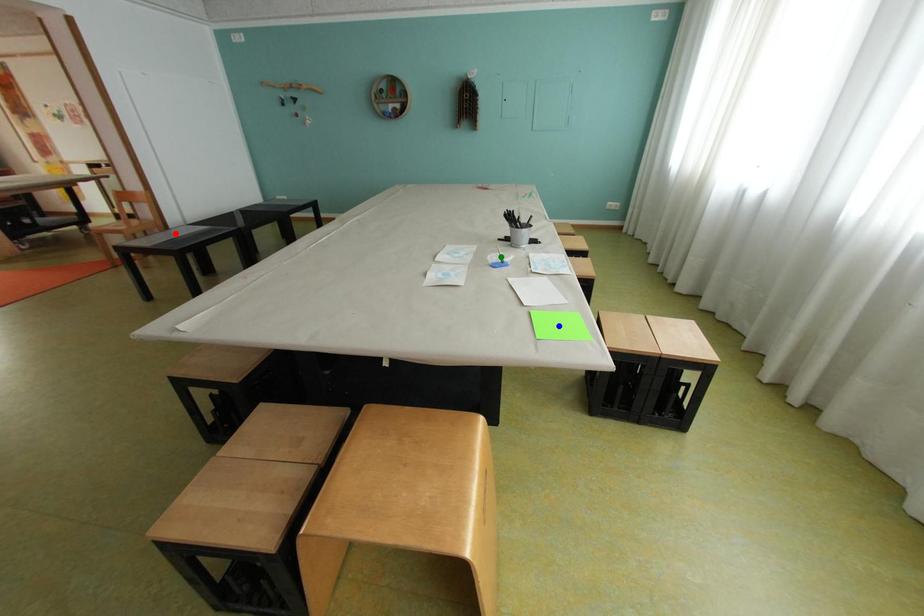
Order these from nearest to farthest:
A) green point
B) red point
C) blue point

blue point → green point → red point